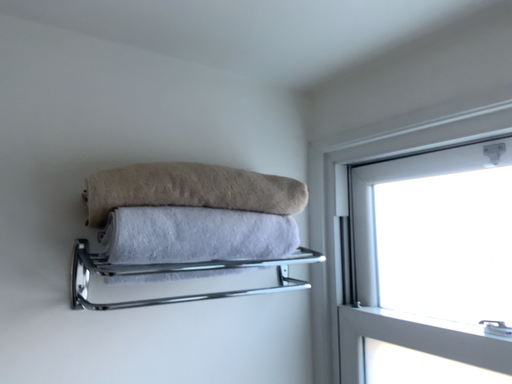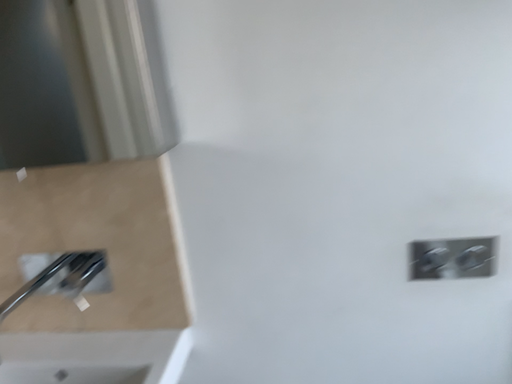
Question: How did the camera likely rotate when shooting the video?

Choices:
 (A) rotated downward
 (B) rotated upward

Answer: (A)